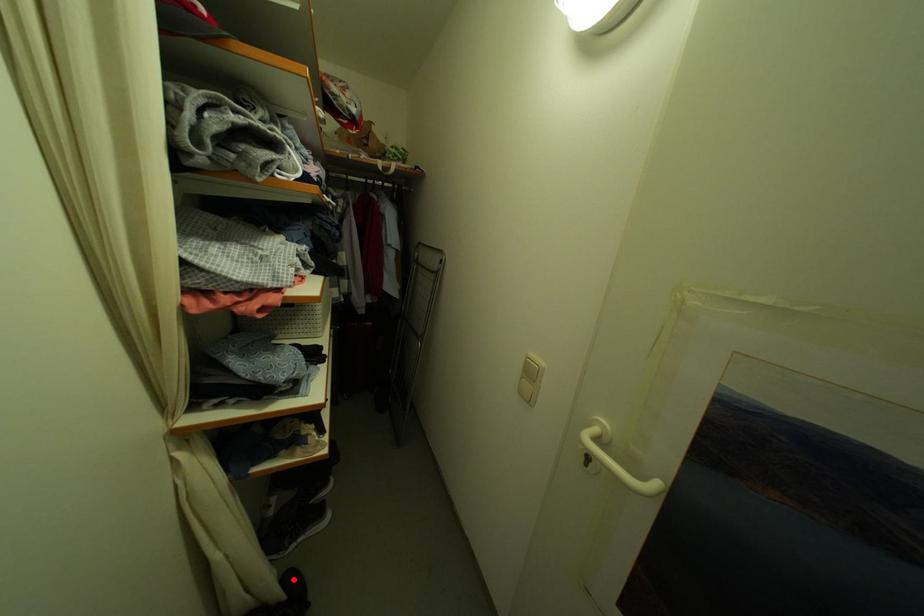
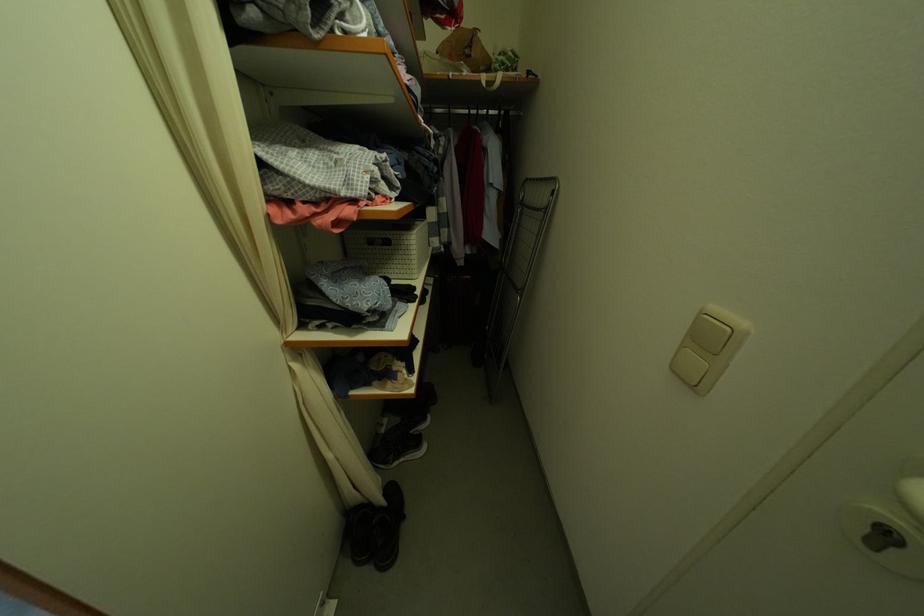
Question: I am providing you with two images of the same scene from different viewpoints. In image1, a red point is highlighted. Considering the same 3D point in image2, which of the following is correct?

Choices:
 (A) It is closer
 (B) It is farther

Answer: (A)